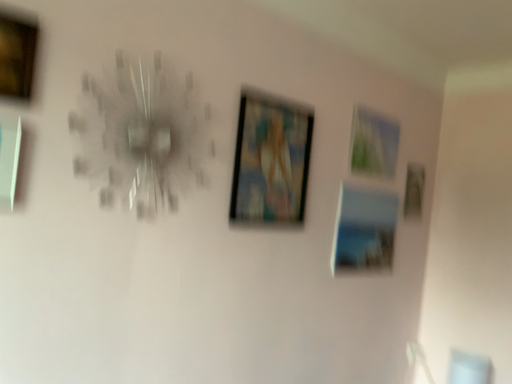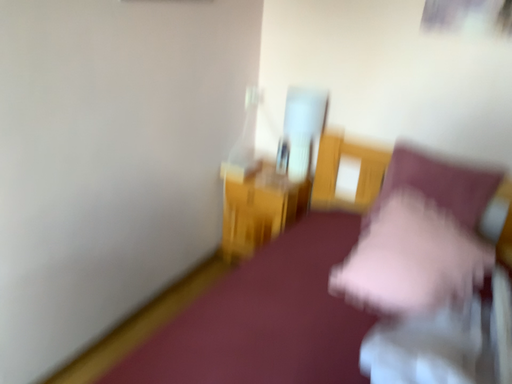
Question: How did the camera likely rotate when shooting the video?

Choices:
 (A) rotated left
 (B) rotated right

Answer: (B)